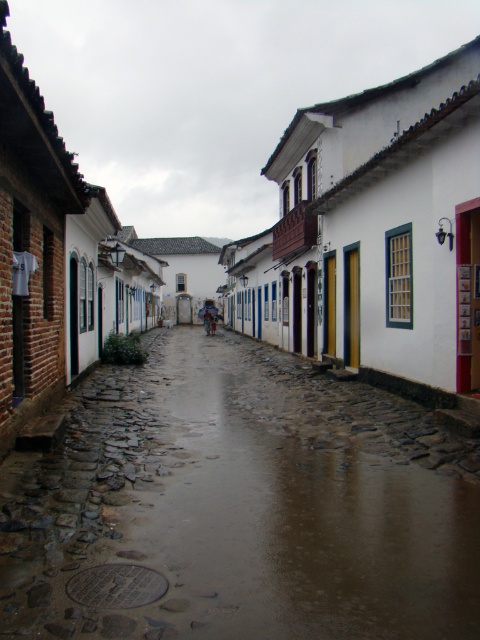
You are standing at the entrance of a narrow cobblestone street and see the wet cobblestone alley at center and the smooth cobblestone street at center. Which one is located to the right side of the other?

The wet cobblestone alley at center is located to the right of the smooth cobblestone street at center.

You are a delivery person carrying a heavy box and need to walk from the wet cobblestone alley at center to the smooth cobblestone street at center. Which path has a lower elevation and would be easier to ascend?

The wet cobblestone alley at center has a lesser height compared to the smooth cobblestone street at center, so it is lower in elevation and easier to ascend from there to the higher smooth cobblestone street.